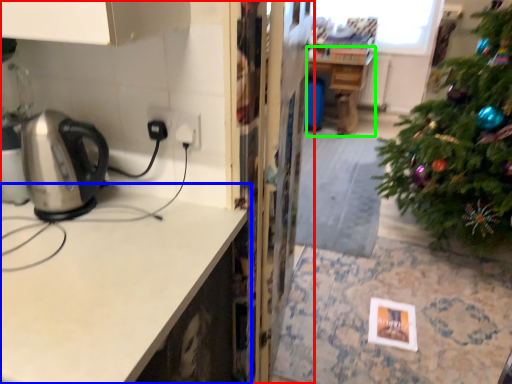
Question: Which object is positioned closest to cabinetry (highlighted by a red box)? Select from countertop (highlighted by a blue box) and table (highlighted by a green box).

Choices:
 (A) countertop
 (B) table

Answer: (A)